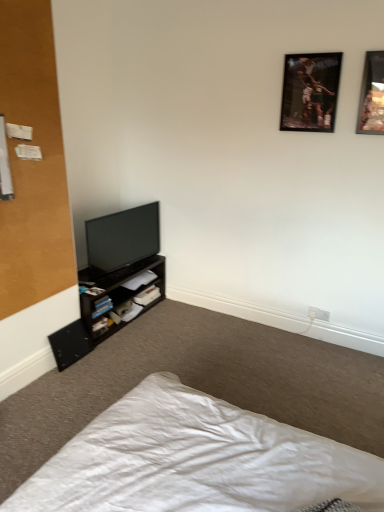
Question: From the image's perspective, is wooden-framed picture at upper right, the 2th picture frame in the right-to-left sequence, over white fabric bed at lower left?

Choices:
 (A) yes
 (B) no

Answer: (A)

Question: Is wooden-framed picture at upper right, the first picture frame in the left-to-right sequence, smaller than white fabric bed at lower left?

Choices:
 (A) yes
 (B) no

Answer: (A)

Question: Does wooden-framed picture at upper right, the first picture frame in the left-to-right sequence, have a greater width compared to white fabric bed at lower left?

Choices:
 (A) yes
 (B) no

Answer: (B)

Question: Is white fabric bed at lower left at the back of wooden-framed picture at upper right, the 2th picture frame in the right-to-left sequence?

Choices:
 (A) no
 (B) yes

Answer: (A)

Question: Can you confirm if wooden-framed picture at upper right, the 2th picture frame in the right-to-left sequence, is positioned to the left of white fabric bed at lower left?

Choices:
 (A) yes
 (B) no

Answer: (B)

Question: Considering their positions, is hardcover book at lower left, the 1th book positioned from the bottom, located in front of or behind white paper at lower center, which ranks as the 2th book in top-to-bottom order?

Choices:
 (A) front
 (B) behind

Answer: (A)

Question: From a real-world perspective, is hardcover book at lower left, the 1th book positioned from the bottom, above or below white paper at lower center, which ranks as the 2th book in top-to-bottom order?

Choices:
 (A) above
 (B) below

Answer: (B)

Question: Is hardcover book at lower left, which appears as the third book when viewed from the top, wider or thinner than white paper at lower center, which ranks as the 2th book in top-to-bottom order?

Choices:
 (A) thin
 (B) wide

Answer: (A)

Question: Is hardcover book at lower left, which appears as the third book when viewed from the top, inside the boundaries of white paper at lower center, which ranks as the 2th book in top-to-bottom order, or outside?

Choices:
 (A) inside
 (B) outside

Answer: (B)

Question: Visually, is white paper at lower center, which ranks as the 2th book in top-to-bottom order, positioned to the left or to the right of white matte book at lower left, acting as the third book starting from the bottom?

Choices:
 (A) right
 (B) left

Answer: (A)

Question: In terms of size, does white paper at lower center, which ranks as the 2th book in top-to-bottom order, appear bigger or smaller than white matte book at lower left, which appears as the 1th book when viewed from the top?

Choices:
 (A) big
 (B) small

Answer: (B)

Question: From the image's perspective, relative to white matte book at lower left, which appears as the 1th book when viewed from the top, is white paper at lower center, which ranks as the 2th book in top-to-bottom order, above or below?

Choices:
 (A) below
 (B) above

Answer: (A)

Question: Considering the positions of white paper at lower center, which ranks as the 2th book in top-to-bottom order, and white matte book at lower left, which appears as the 1th book when viewed from the top, in the image, is white paper at lower center, which ranks as the 2th book in top-to-bottom order, wider or thinner than white matte book at lower left, which appears as the 1th book when viewed from the top,?

Choices:
 (A) thin
 (B) wide

Answer: (A)

Question: Is point (360, 97) positioned closer to the camera than point (82, 308)?

Choices:
 (A) farther
 (B) closer

Answer: (B)

Question: Based on their positions, is wooden picture frame at upper right, acting as the 2th picture frame starting from the left, located to the left or right of dark brown wooden shelf at lower left?

Choices:
 (A) left
 (B) right

Answer: (B)